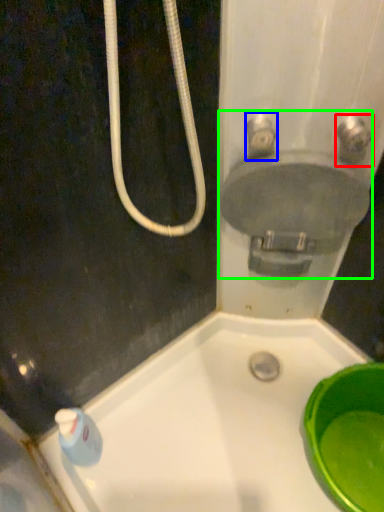
Question: Based on their relative distances, which object is nearer to plumbing fixture (highlighted by a red box)? Choose from plumbing fixture (highlighted by a blue box) and sink (highlighted by a green box).

Choices:
 (A) plumbing fixture
 (B) sink

Answer: (B)